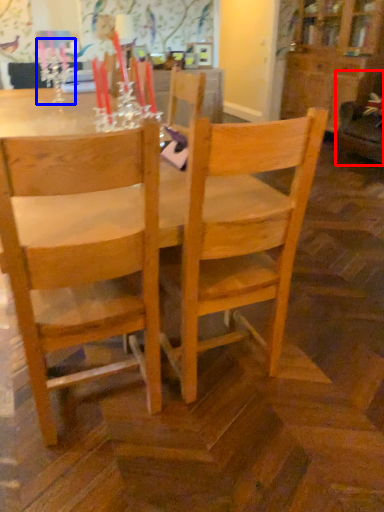
Question: Which of the following is the farthest to the observer, swivel chair (highlighted by a red box) or candle holder (highlighted by a blue box)?

Choices:
 (A) swivel chair
 (B) candle holder

Answer: (A)